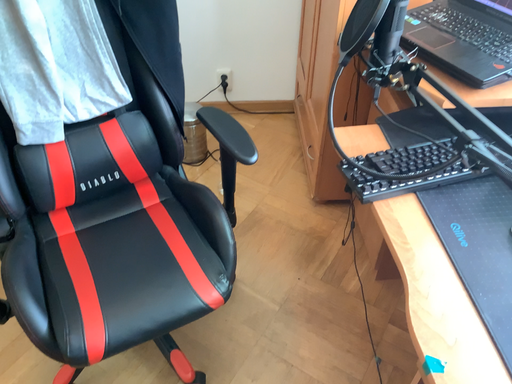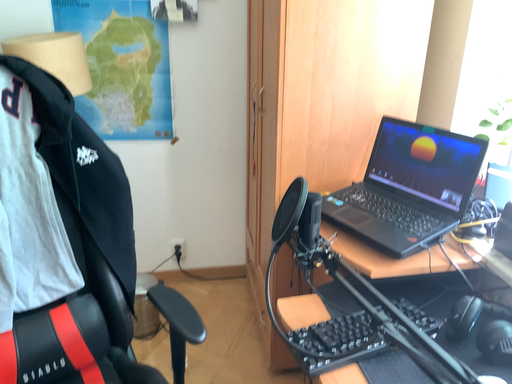
Question: How did the camera likely rotate when shooting the video?

Choices:
 (A) rotated upward
 (B) rotated downward

Answer: (A)